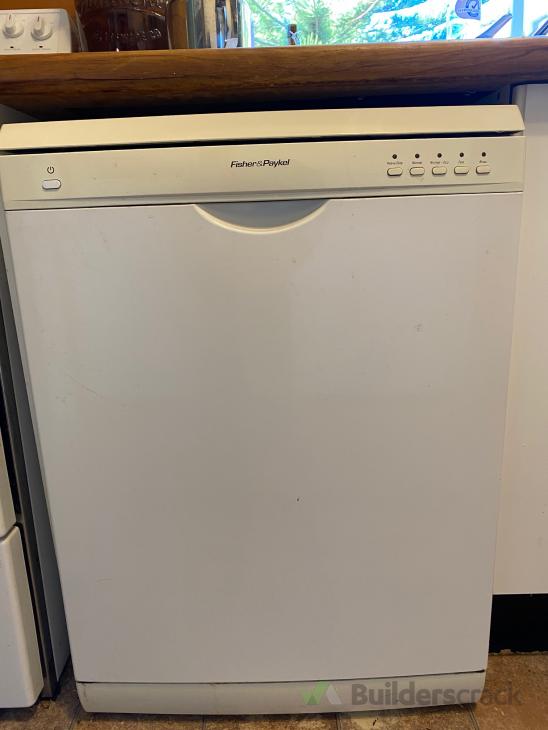
What are the coordinates of `floor` in the screenshot? It's located at (525, 677).